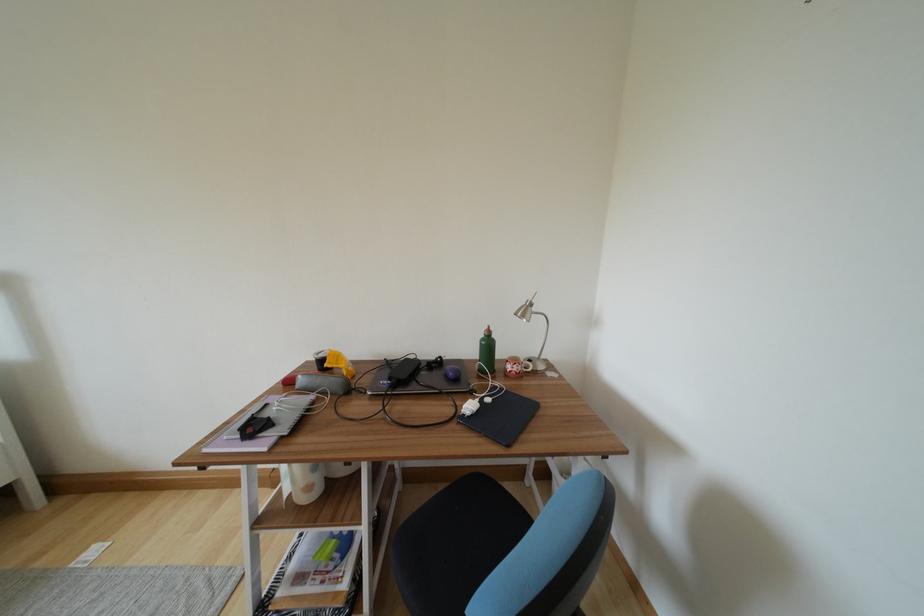
Which object does [487,353] point to?

It corresponds to the green water bottle in the image.